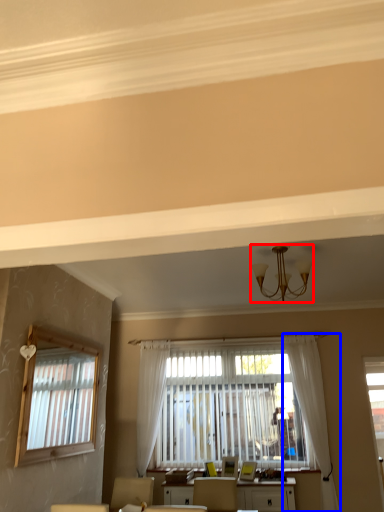
Question: Which of the following is the closest to the observer, light fixture (highlighted by a red box) or curtain (highlighted by a blue box)?

Choices:
 (A) light fixture
 (B) curtain

Answer: (A)